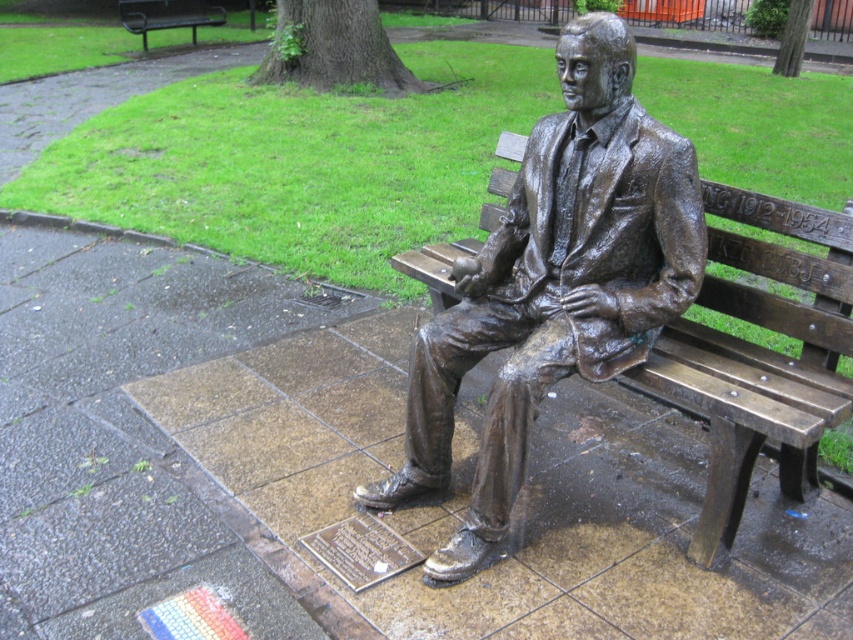
You are an artist planning to create a miniature replica of the scene. Which object, the bronze statue at center or the bronze bench at upper left, will require less material due to its smaller width?

The bronze statue at center is thinner than the bronze bench at upper left, so it will require less material for the replica.